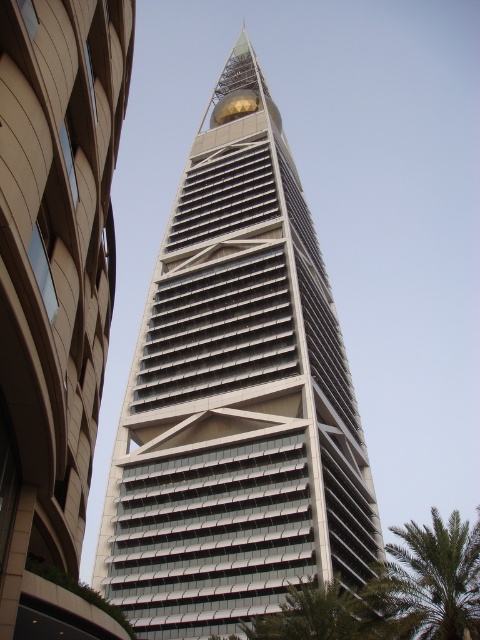
You are a drone operator trying to capture aerial footage of the white glass skyscraper at center and the green leafy palm tree at lower right. Which object will appear larger in your camera frame?

The white glass skyscraper at center will appear larger in the camera frame because it is much taller than the green leafy palm tree at lower right.

You are standing in front of the skyscraper and notice a point marked at coordinates [236,396]. Based on the description, which object does this point most likely belong to?

The point at coordinates [236,396] corresponds to the white glass skyscraper at center.